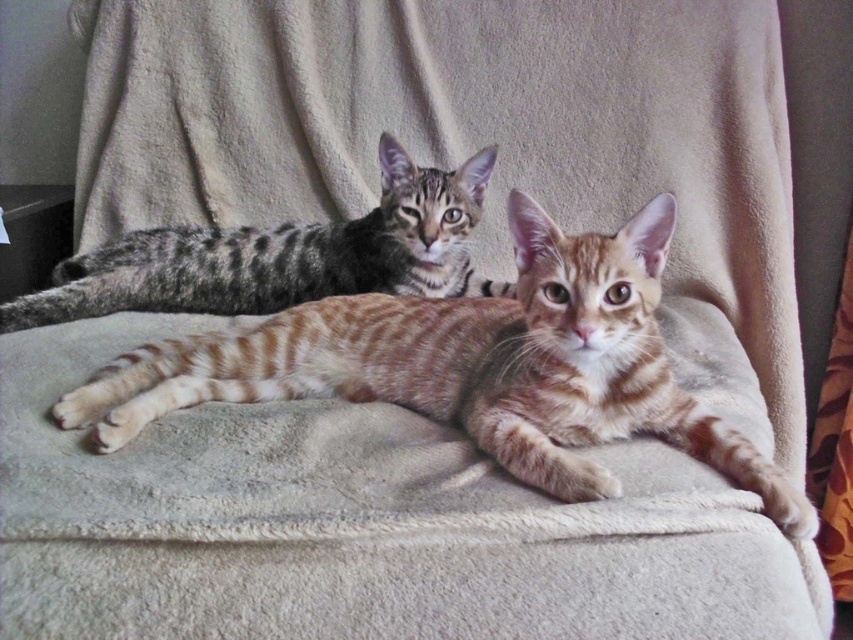
Can you confirm if golden tabby cat at center is taller than gray striped kitten at upper left?

Indeed, golden tabby cat at center has a greater height compared to gray striped kitten at upper left.

Who is positioned more to the right, golden tabby cat at center or gray striped kitten at upper left?

From the viewer's perspective, golden tabby cat at center appears more on the right side.

Identify the location of golden tabby cat at center. The width and height of the screenshot is (853, 640). (473, 365).

Identify the location of golden tabby cat at center. Image resolution: width=853 pixels, height=640 pixels. (473, 365).